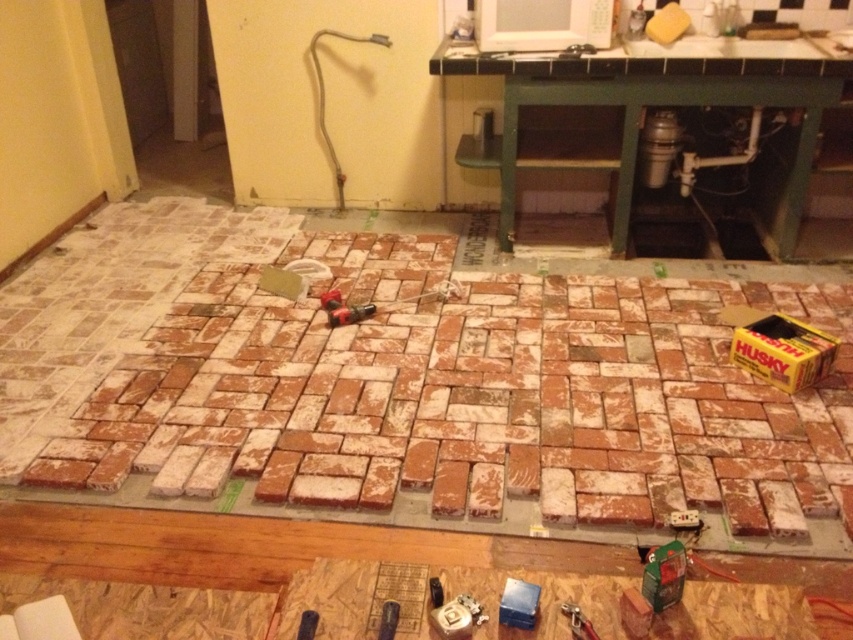
Question: Which of the following is the farthest from the observer?

Choices:
 (A) metallic blue screwdriver at lower center
 (B) metallic silver screwdriver at center
 (C) metallic red drill at center
 (D) metallic silver wrench at lower center

Answer: (C)

Question: Is metallic red drill at center positioned at the back of metallic silver wrench at lower center?

Choices:
 (A) no
 (B) yes

Answer: (B)

Question: Is metallic silver wrench at lower center to the right of metallic blue screwdriver at lower center from the viewer's perspective?

Choices:
 (A) yes
 (B) no

Answer: (A)

Question: Is terracotta clay bricks at center behind metallic blue screwdriver at lower center?

Choices:
 (A) no
 (B) yes

Answer: (B)

Question: Which of these objects is positioned farthest from the metallic red drill at center?

Choices:
 (A) metallic silver screwdriver at center
 (B) terracotta clay bricks at center
 (C) metallic blue screwdriver at lower center

Answer: (A)

Question: Which object is positioned farthest from the terracotta clay bricks at center?

Choices:
 (A) metallic silver wrench at lower center
 (B) metallic blue screwdriver at lower center

Answer: (A)